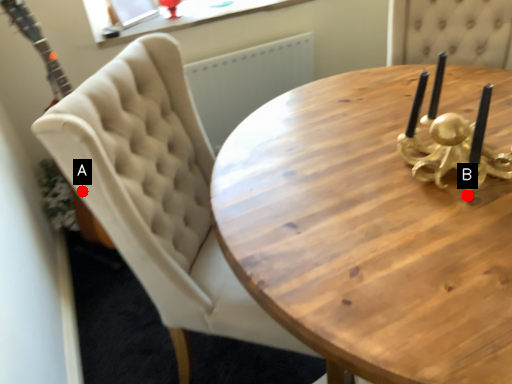
Question: Two points are circled on the image, labeled by A and B beside each circle. Which point is farther to the camera?

Choices:
 (A) A is further
 (B) B is further

Answer: (B)